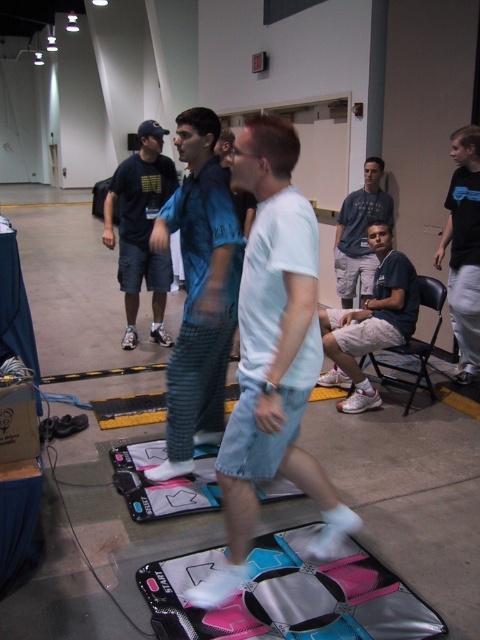
Question: Based on their relative distances, which object is nearer to the light brown shorts at center?

Choices:
 (A) black matte shirt at center
 (B) dark blue t-shirt at center

Answer: (A)

Question: Among these points, which one is nearest to the camera?

Choices:
 (A) (312, 236)
 (B) (186, 380)

Answer: (A)

Question: Is white cotton t-shirt at center thinner than pink fabric yoga mat at lower center?

Choices:
 (A) no
 (B) yes

Answer: (B)

Question: Does dark blue t-shirt at center come in front of black matte shirt at center?

Choices:
 (A) no
 (B) yes

Answer: (A)

Question: Which is nearer to the dark blue t-shirt at center?

Choices:
 (A) blue striped pants at center
 (B) light brown shorts at center
 (C) pink fabric yoga mat at lower center
 (D) matte blue shirt at center

Answer: (A)

Question: Does blue striped pants at center have a greater width compared to dark blue t-shirt at center?

Choices:
 (A) no
 (B) yes

Answer: (A)